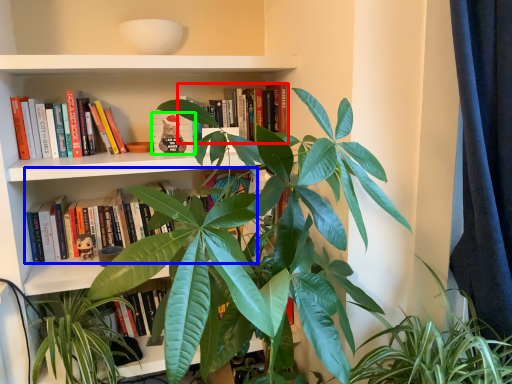
Question: Which object is the farthest from book (highlighted by a red box)? Choose among these: book (highlighted by a blue box) or book (highlighted by a green box).

Choices:
 (A) book
 (B) book

Answer: (A)